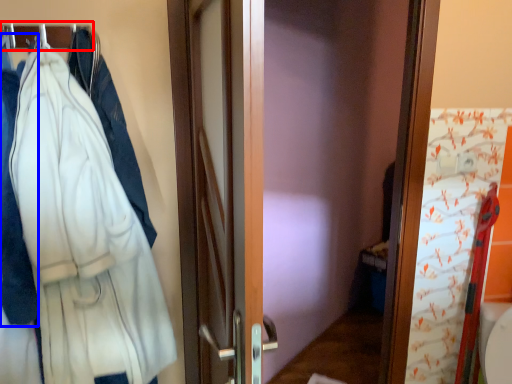
Question: Which object is closer to the camera taking this photo, hanger (highlighted by a red box) or garment (highlighted by a blue box)?

Choices:
 (A) hanger
 (B) garment

Answer: (B)